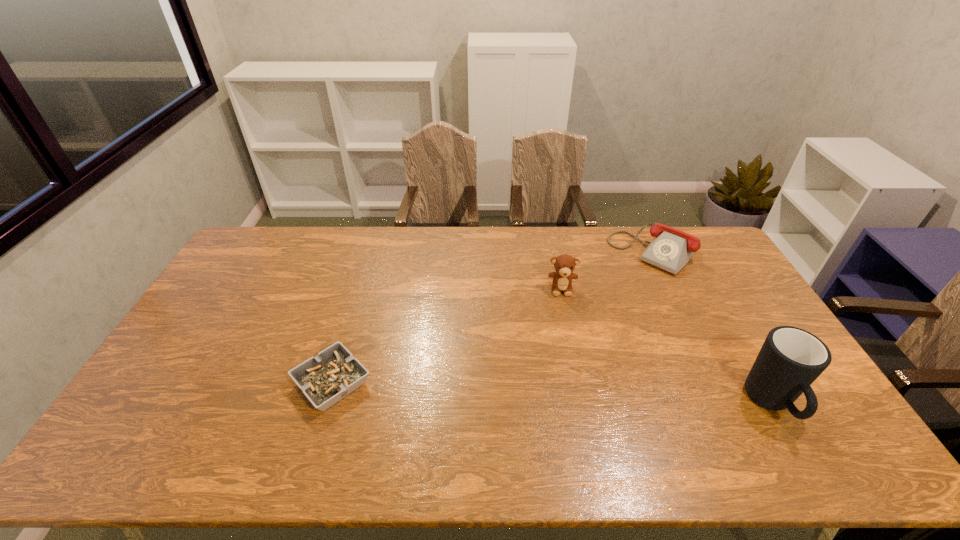
Where is `free space located on the face of the teddy bear`? The image size is (960, 540). free space located on the face of the teddy bear is located at coordinates (565, 346).

Locate an element on the screen. vacant area situated 0.340m on the dial of the farthest object is located at coordinates (585, 325).

You are a GUI agent. You are given a task and a screenshot of the screen. Output one action in this format:
    pyautogui.click(x=<x>, y=<y>)
    Task: Click on the vacant position located on the dial of the farthest object
    This screenshot has width=960, height=540.
    Given the screenshot: What is the action you would take?
    pyautogui.click(x=611, y=296)

At what (x,y) coordinates should I click in order to perform the action: click on free space located 0.200m on the dial of the farthest object. Please return your answer as a coordinate pair (x, y). Looking at the image, I should click on (607, 301).

Where is `object situated at the far edge`? object situated at the far edge is located at coordinates (671, 249).

I want to click on ashtray at the near edge, so click(334, 373).

Identify the location of mug present at the near edge. (791, 359).

The width and height of the screenshot is (960, 540). In order to click on mug located at the right edge in this screenshot , I will do `click(791, 359)`.

This screenshot has height=540, width=960. I want to click on telephone present at the right edge, so click(671, 249).

This screenshot has width=960, height=540. Find the location of `object positioned at the far right corner`. object positioned at the far right corner is located at coordinates (671, 249).